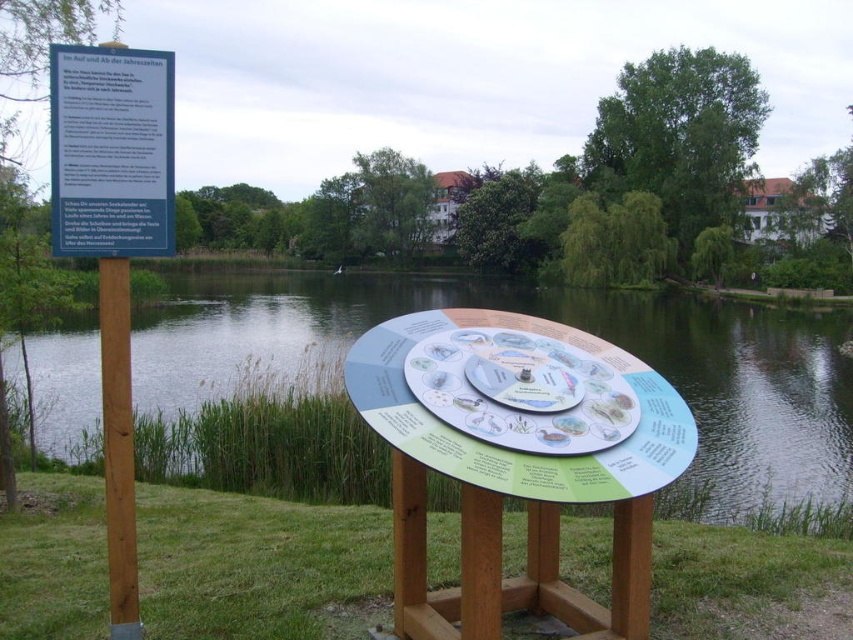
Which is more to the left, green water at center or blue plastic sign at upper left?

green water at center is more to the left.

Does green water at center have a greater height compared to blue plastic sign at upper left?

Yes, green water at center is taller than blue plastic sign at upper left.

Between point (740, 508) and point (82, 188), which one is positioned in front?

Positioned in front is point (82, 188).

Identify the location of green water at center. (494, 307).

Can you confirm if green water at center is smaller than brown wooden pole at left?

No.

Who is positioned more to the left, green water at center or brown wooden pole at left?

From the viewer's perspective, green water at center appears more on the left side.

The width and height of the screenshot is (853, 640). What are the coordinates of `green water at center` in the screenshot? It's located at (494, 307).

Between matte plastic circular display at center and brown wooden pole at left, which one is positioned lower?

matte plastic circular display at center is below.

Does matte plastic circular display at center appear on the right side of brown wooden pole at left?

Correct, you'll find matte plastic circular display at center to the right of brown wooden pole at left.

Image resolution: width=853 pixels, height=640 pixels. What do you see at coordinates (521, 390) in the screenshot?
I see `matte plastic circular display at center` at bounding box center [521, 390].

Find the location of a particular element. This screenshot has width=853, height=640. matte plastic circular display at center is located at coordinates (521, 390).